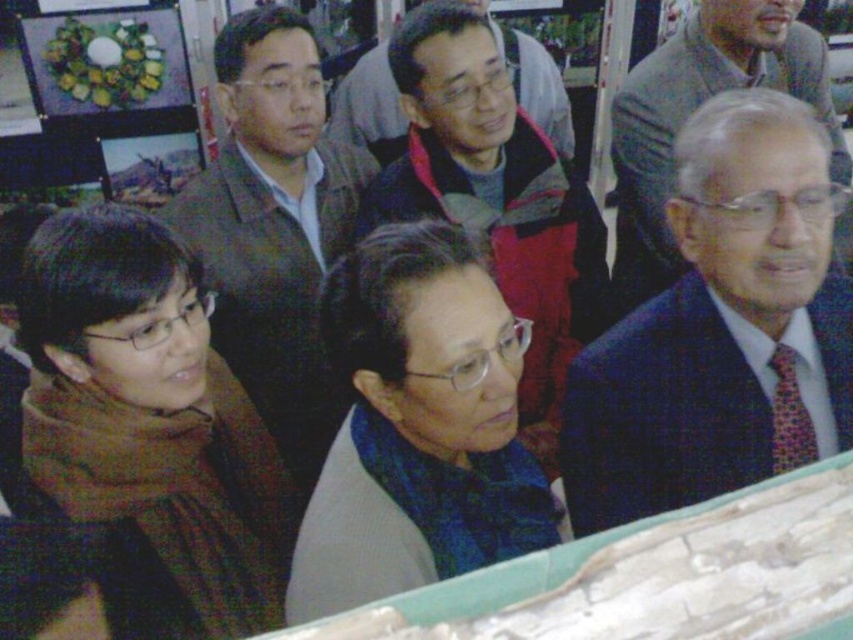
You are standing in the gallery and want to get a better view of the artwork. The brown wool scarf at left and the dark blue suit at right are blocking your view. Which of these two items is closer to you?

The brown wool scarf at left is closer to you because it is in front of the dark blue suit at right.

You are a photographer in a gallery. You want to capture a photo of the dark blue suit at right and the matte brown suit at center. The minimum distance your camera can focus on two subjects is 1 meter. Can you take the photo without moving the subjects?

The distance between the dark blue suit at right and the matte brown suit at center is 90.16 centimeters, which is less than 1 meter. Therefore, the camera cannot focus on both subjects simultaneously without moving them closer apart.

You are a photographer at the event and want to capture a photo of the blue fabric scarf at center and dark blue suit at center. Since both are at the center, how are they positioned relative to each other?

The blue fabric scarf at center is positioned to the left of the dark blue suit at center.